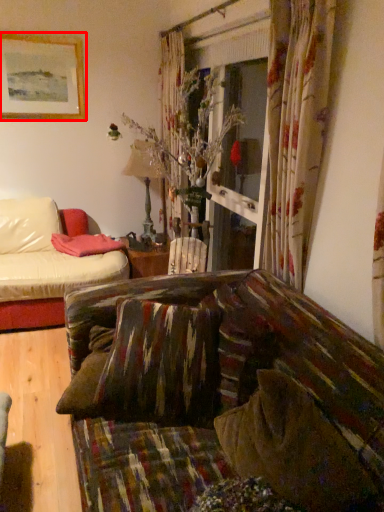
Question: In this image, where is picture frame (annotated by the red box) located relative to pillow?

Choices:
 (A) right
 (B) left

Answer: (B)